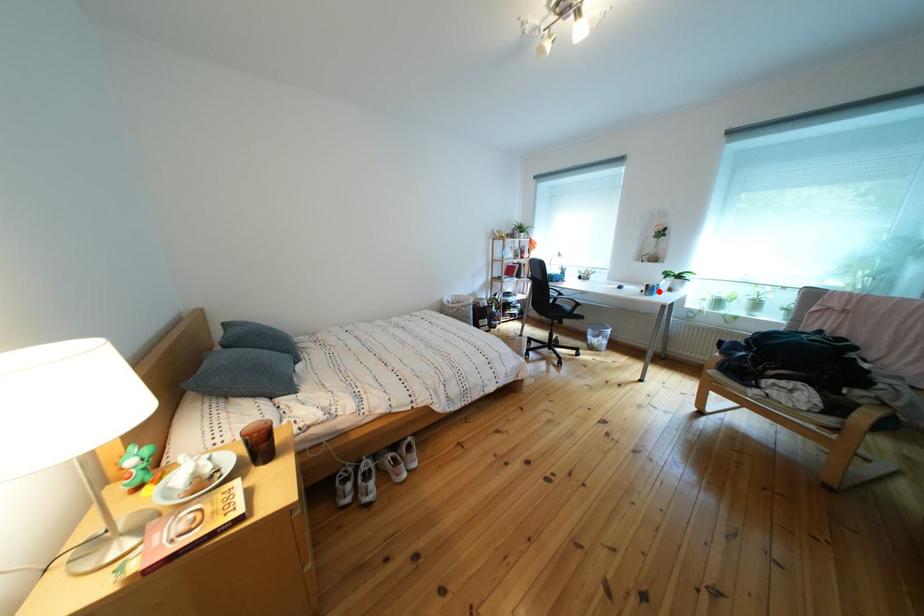
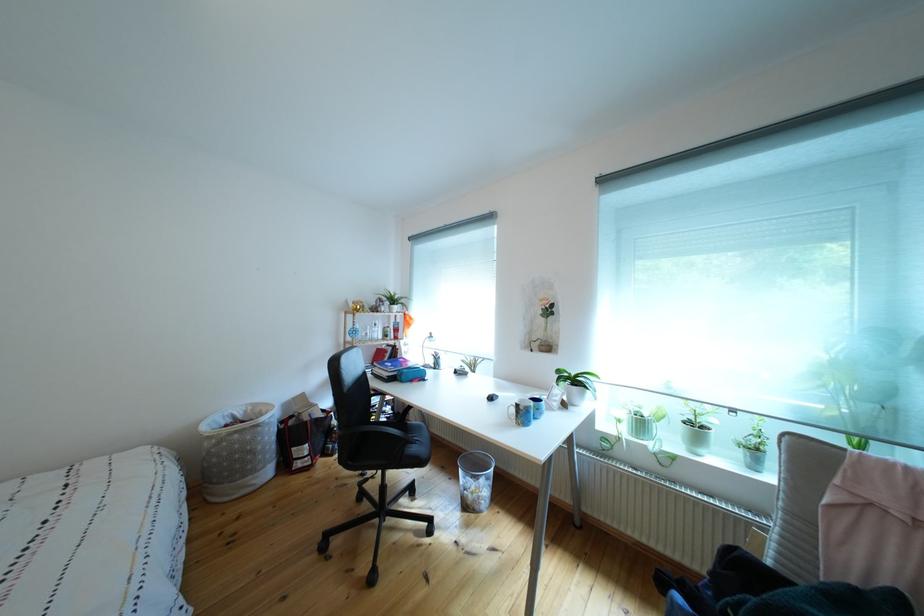
Where in the second image is the point corresponding to the highlighted location from the first image?

(529, 411)